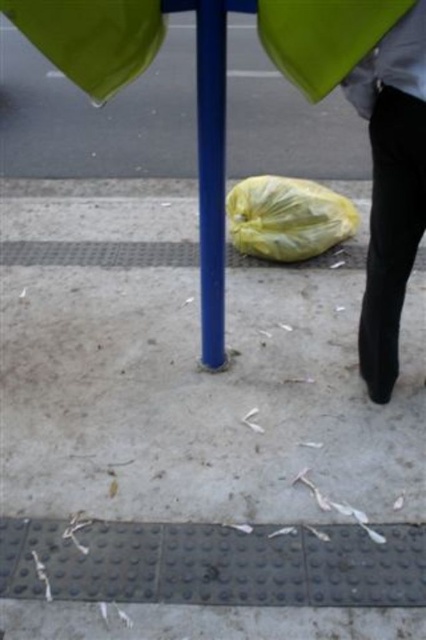
Question: Which of the following is the closest to the observer?

Choices:
 (A) blue glossy pole at center
 (B) yellow plastic bag at lower center

Answer: (A)

Question: Is blue glossy pole at center further to camera compared to yellow plastic bag at lower center?

Choices:
 (A) no
 (B) yes

Answer: (A)

Question: Is blue glossy pole at center thinner than yellow plastic bag at lower center?

Choices:
 (A) yes
 (B) no

Answer: (A)

Question: Among these points, which one is nearest to the camera?

Choices:
 (A) (219, 208)
 (B) (340, 237)
 (C) (311, 45)

Answer: (C)

Question: Based on their relative distances, which object is nearer to the blue glossy pole at center?

Choices:
 (A) yellow plastic bag at lower center
 (B) yellow matte plastic bag at center

Answer: (B)

Question: Where is yellow matte plastic bag at center located in relation to blue glossy pole at center in the image?

Choices:
 (A) below
 (B) above

Answer: (B)